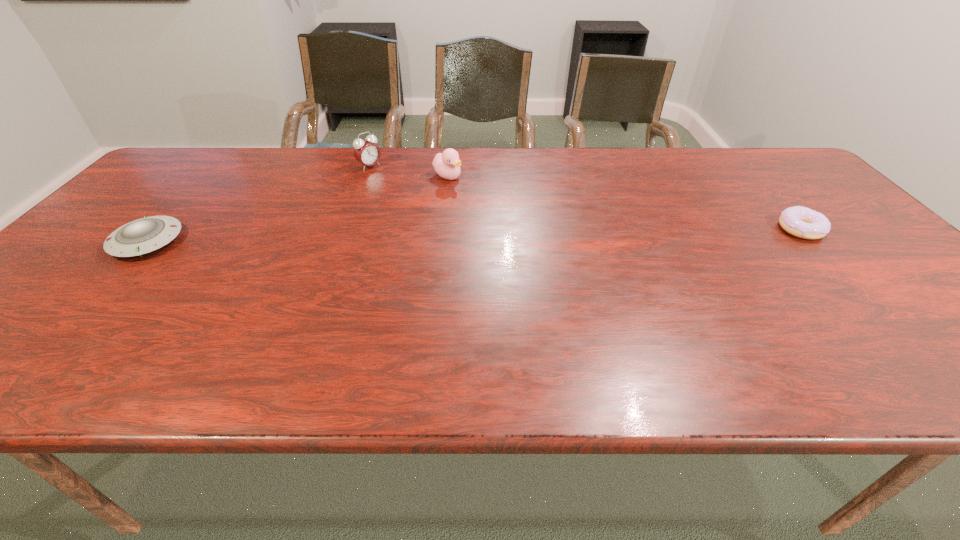
Find the location of a particular element. Image resolution: width=960 pixels, height=540 pixels. the leftmost object is located at coordinates (145, 235).

Identify the location of the rightmost object. (799, 221).

Where is `the third object from left to right`? The height and width of the screenshot is (540, 960). the third object from left to right is located at coordinates (447, 165).

Locate an element on the screen. This screenshot has width=960, height=540. duckling is located at coordinates (447, 165).

Where is `the third object from right to left`? The width and height of the screenshot is (960, 540). the third object from right to left is located at coordinates (366, 152).

Where is `free region located on the front of the leftmost object`? free region located on the front of the leftmost object is located at coordinates (101, 292).

Locate an element on the screen. The image size is (960, 540). vacant space located on the left of the doughnut is located at coordinates (702, 229).

Locate an element on the screen. The height and width of the screenshot is (540, 960). vacant position located 0.220m on the front-facing side of the second tallest object is located at coordinates (514, 210).

The image size is (960, 540). I want to click on vacant space located 0.390m on the front-facing side of the second tallest object, so click(564, 236).

The height and width of the screenshot is (540, 960). Find the location of `free region located on the front-facing side of the second tallest object`. free region located on the front-facing side of the second tallest object is located at coordinates (492, 199).